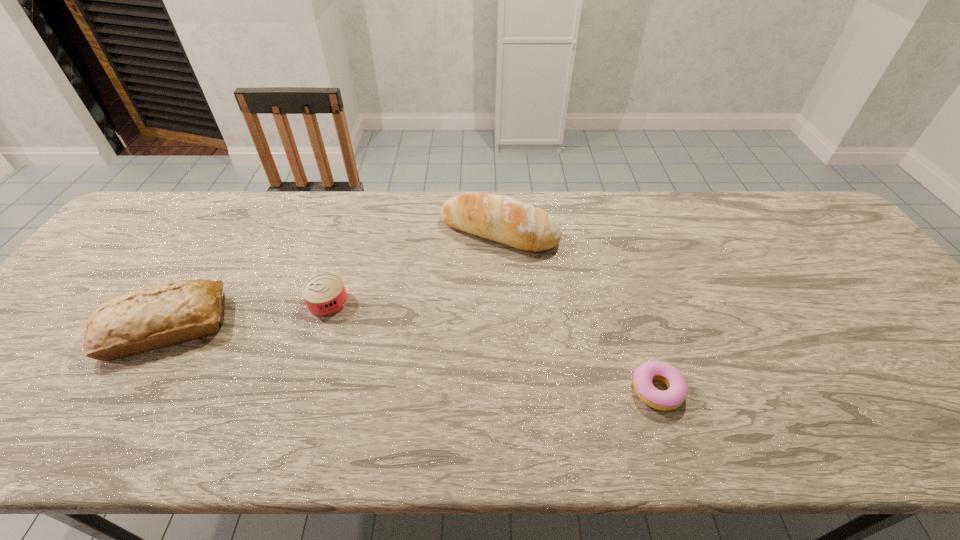
Locate an element on the screen. free space that is in between the rightmost object and the leftmost object is located at coordinates (412, 359).

You are a GUI agent. You are given a task and a screenshot of the screen. Output one action in this format:
    pyautogui.click(x=<x>, y=<y>)
    Task: Click on the unoccupied position between the shortest object and the farther bread
    The image size is (960, 540).
    Given the screenshot: What is the action you would take?
    pyautogui.click(x=578, y=310)

Image resolution: width=960 pixels, height=540 pixels. Identify the location of vacant area that lies between the farther bread and the rightmost object. (578, 310).

Where is `vacant area that lies between the rightmost object and the can`? The height and width of the screenshot is (540, 960). vacant area that lies between the rightmost object and the can is located at coordinates (492, 346).

Where is `free area in between the farther bread and the doughnut`? The height and width of the screenshot is (540, 960). free area in between the farther bread and the doughnut is located at coordinates (578, 310).

This screenshot has height=540, width=960. In order to click on free spot between the doughnut and the leftmost object in this screenshot , I will do `click(412, 359)`.

Find the location of a particular element. The height and width of the screenshot is (540, 960). free space between the doughnut and the third tallest object is located at coordinates (492, 346).

Where is `vacant area between the third object from right to left and the farther bread`? vacant area between the third object from right to left and the farther bread is located at coordinates (414, 267).

This screenshot has height=540, width=960. Identify the location of object that stands as the third closest to the farthest object. (155, 317).

Identify the location of object that is the nearest to the can. (155, 317).